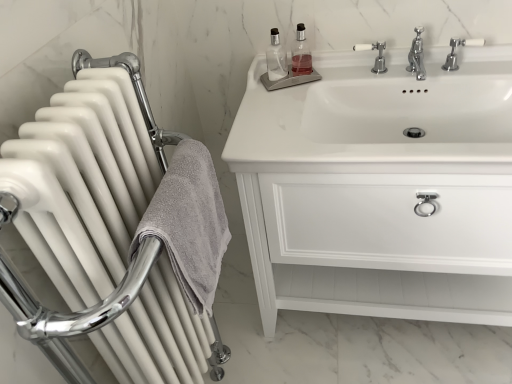
Identify the location of vacant region to the left of white ceramic tap at upper center, the first tap positioned from the left. The width and height of the screenshot is (512, 384). (315, 81).